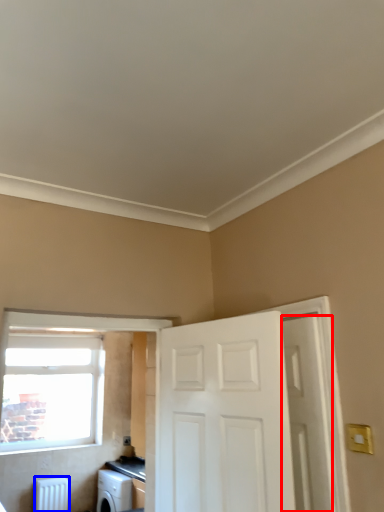
Question: Which of the following is the closest to the observer, door (highlighted by a red box) or radiator (highlighted by a blue box)?

Choices:
 (A) door
 (B) radiator

Answer: (A)